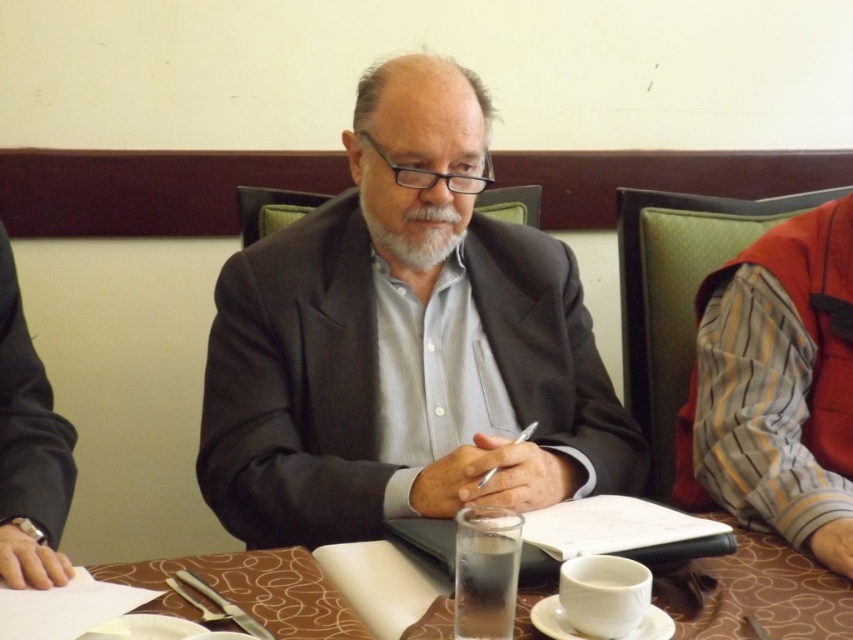
You are sitting at the table and want to pick up the white ceramic cup at center and the white matte beard at center. Which one do you need to reach further to grab?

The white matte beard at center is further away from you than the white ceramic cup at center, so you need to reach further to grab the white matte beard at center.

You are attending a formal meeting and notice the white ceramic cup at center and the white matte beard at center. Which object is positioned lower relative to the other?

The white ceramic cup at center is positioned below the white matte beard at center.

Please describe the location of the point marked at coordinates (766, 593) in the scene.

The point at coordinates (766, 593) is located on the brown textured table at center.